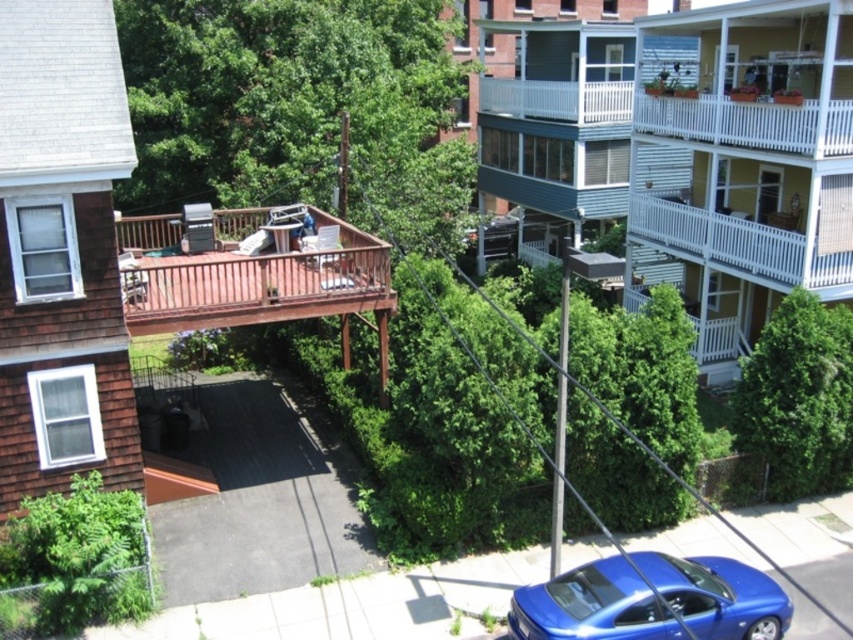
You are standing in the residential neighborhood scene and want to walk from the green leafy tree at center to the shiny blue car at lower right. Which direction should you move relative to the tree?

You should move towards the lower right direction relative to the green leafy tree at center to reach the shiny blue car at lower right since the car is positioned at a lower right position compared to the tree.

You are standing in the residential neighborhood scene and want to determine the relative positions of two points marked in the image. Which point is closer to you, point 1 at coordinates [247,74] or point 2 at coordinates [628,634]?

Point 1 at coordinates [247,74] is closer to you because it is further to the camera than point 2 at coordinates [628,634].

You are standing at the point marked by the coordinates point (294, 104) in the residential neighborhood scene. What object are you directly at?

The point (294, 104) marks the green leafy tree at center.